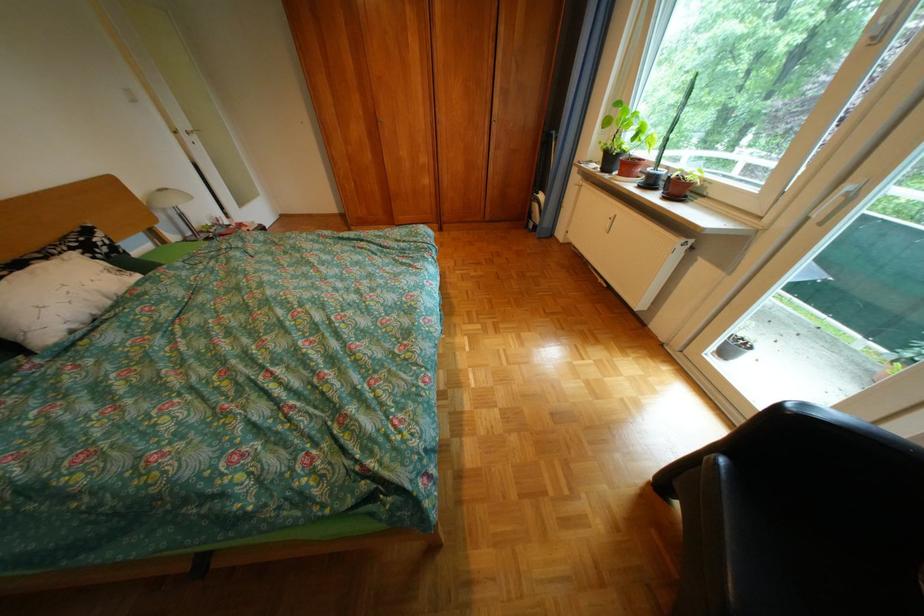
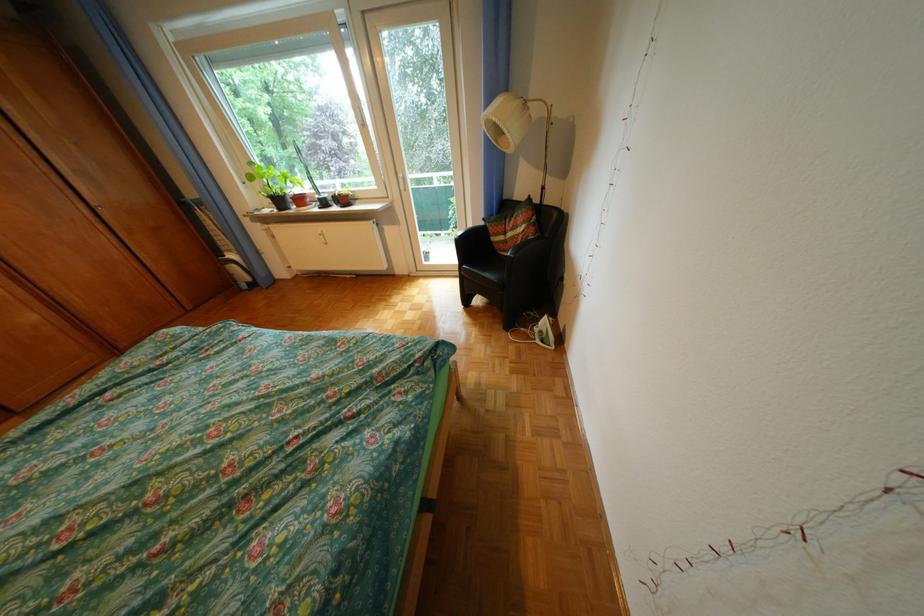
Find the pixel in the second image that matches point (615, 156) in the first image.

(284, 201)